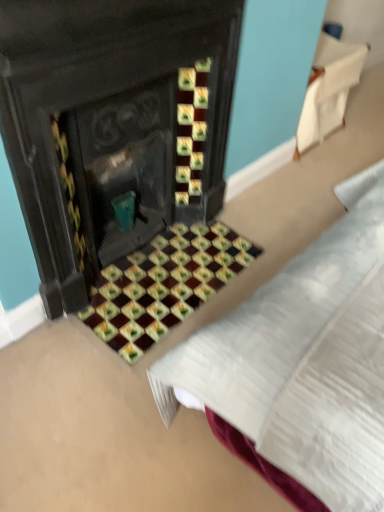
Question: From their relative heights in the image, would you say white fabric at upper right is taller or shorter than marble mosaic tiles at center?

Choices:
 (A) tall
 (B) short

Answer: (A)

Question: Is white fabric at upper right wider or thinner than marble mosaic tiles at center?

Choices:
 (A) thin
 (B) wide

Answer: (A)

Question: Is white fabric at upper right situated inside marble mosaic tiles at center or outside?

Choices:
 (A) inside
 (B) outside

Answer: (B)

Question: Is marble mosaic tiles at center in front of or behind white fabric at upper right in the image?

Choices:
 (A) behind
 (B) front

Answer: (B)

Question: Is marble mosaic tiles at center inside or outside of white fabric at upper right?

Choices:
 (A) inside
 (B) outside

Answer: (B)

Question: Is point (92, 294) positioned closer to the camera than point (344, 54)?

Choices:
 (A) farther
 (B) closer

Answer: (B)

Question: In the image, is marble mosaic tiles at center on the left side or the right side of white fabric at upper right?

Choices:
 (A) left
 (B) right

Answer: (A)